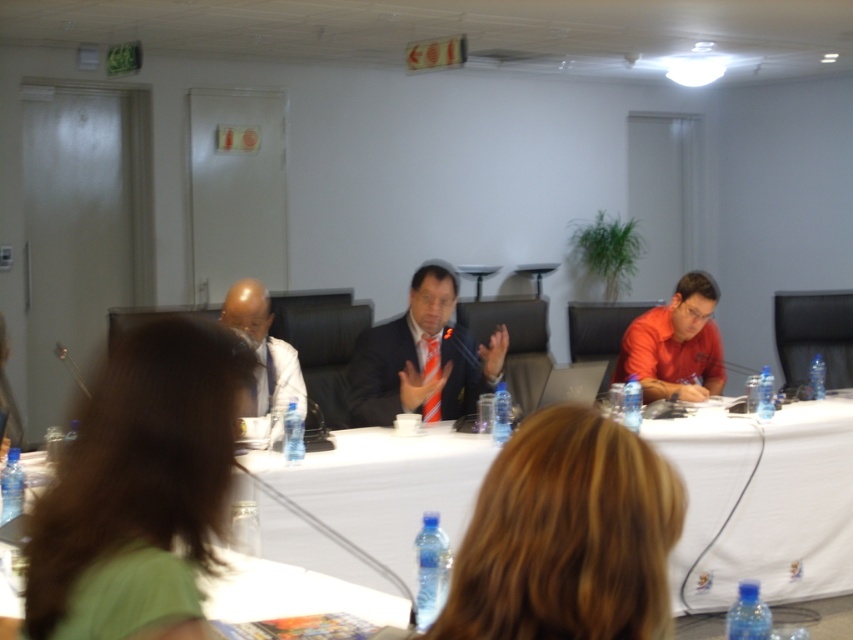
You are standing at the entrance of the room and see the point marked at coordinate (138, 484). What object or feature is located at that point?

The point marked at coordinate (138, 484) is located on the green matte shirt at center.